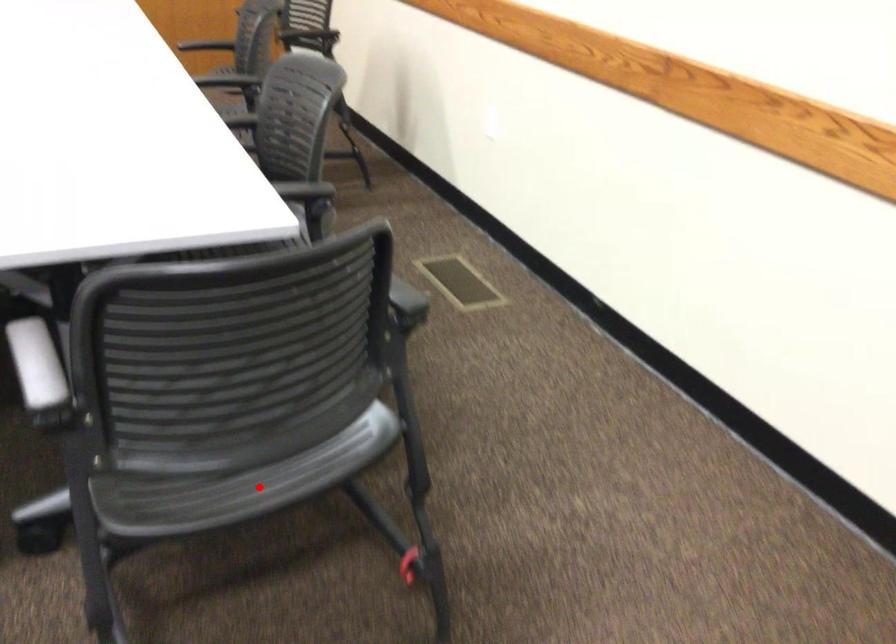
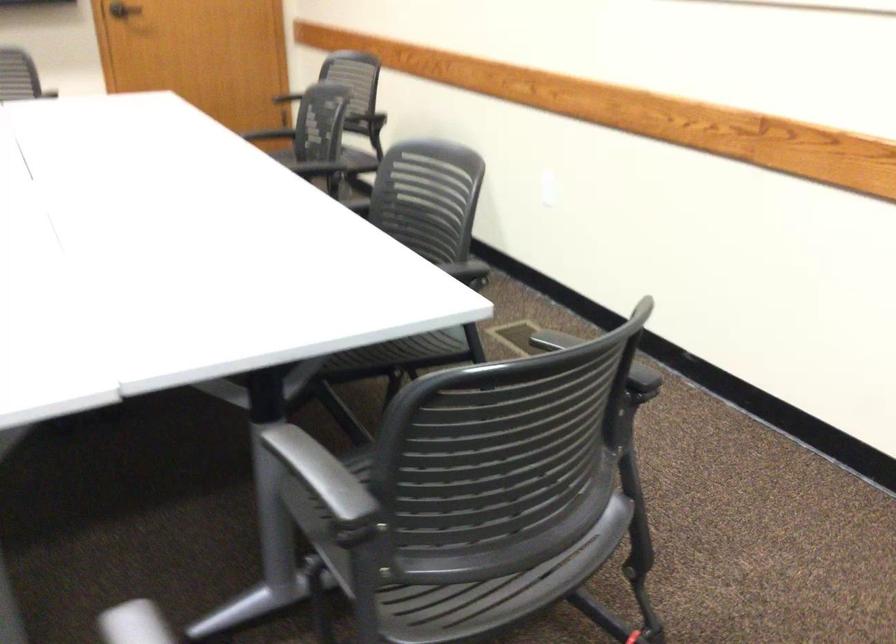
Find the pixel in the second image that matches the highlighted location in the first image.

(496, 590)